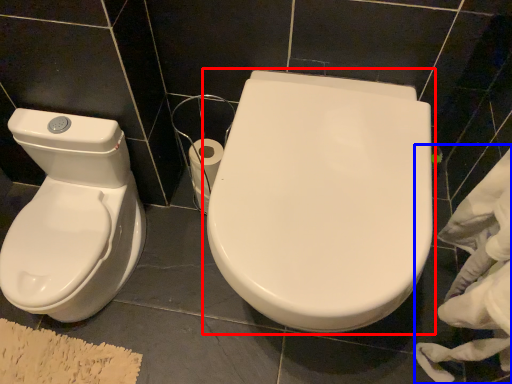
Question: Which point is closer to the camera, toilet (highlighted by a red box) or material (highlighted by a blue box)?

Choices:
 (A) toilet
 (B) material

Answer: (B)